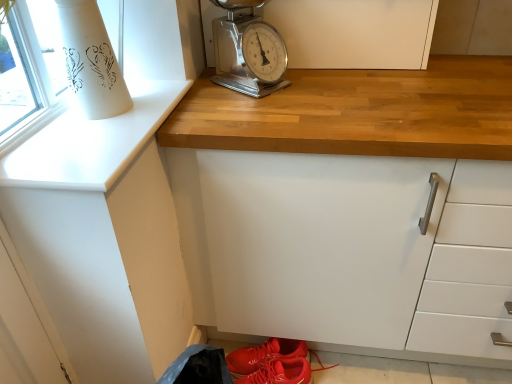
Question: Is metallic scale at upper center directly adjacent to white matte cabinet at upper center, placed as the first cabinetry when sorted from back to front?

Choices:
 (A) yes
 (B) no

Answer: (B)

Question: From the image's perspective, is metallic scale at upper center on white matte cabinet at upper center, the second cabinetry from the front?

Choices:
 (A) yes
 (B) no

Answer: (B)

Question: Is metallic scale at upper center not inside white matte cabinet at upper center, the second cabinetry from the front?

Choices:
 (A) yes
 (B) no

Answer: (A)

Question: Is metallic scale at upper center further to the viewer compared to white matte cabinet at upper center, placed as the first cabinetry when sorted from back to front?

Choices:
 (A) no
 (B) yes

Answer: (A)

Question: From a real-world perspective, is metallic scale at upper center on top of white matte cabinet at upper center, the second cabinetry from the front?

Choices:
 (A) yes
 (B) no

Answer: (A)

Question: Can you confirm if metallic scale at upper center is positioned to the right of white matte cabinet at upper center, the second cabinetry from the front?

Choices:
 (A) no
 (B) yes

Answer: (A)

Question: Could white matte cabinet at upper center, marked as the 1th cabinetry in a front-to-back arrangement, be considered to be inside white matte cabinet at upper center, placed as the first cabinetry when sorted from back to front?

Choices:
 (A) no
 (B) yes

Answer: (A)

Question: Is white matte cabinet at upper center, the second cabinetry from the front, looking in the opposite direction of white matte cabinet at upper center, marked as the 1th cabinetry in a front-to-back arrangement?

Choices:
 (A) yes
 (B) no

Answer: (B)

Question: Is white matte cabinet at upper center, the second cabinetry from the front, at the right side of white matte cabinet at upper center, marked as the 1th cabinetry in a front-to-back arrangement?

Choices:
 (A) yes
 (B) no

Answer: (A)

Question: Is white matte cabinet at upper center, the second cabinetry from the front, facing towards white matte cabinet at upper center, marked as the 1th cabinetry in a front-to-back arrangement?

Choices:
 (A) yes
 (B) no

Answer: (A)

Question: Is white matte cabinet at upper center, the second cabinetry from the front, further to the viewer compared to white matte cabinet at upper center, marked as the 1th cabinetry in a front-to-back arrangement?

Choices:
 (A) yes
 (B) no

Answer: (A)

Question: Can you see white matte cabinet at upper center, the second cabinetry from the front, touching white matte cabinet at upper center, placed as the 2th cabinetry when sorted from back to front?

Choices:
 (A) no
 (B) yes

Answer: (A)

Question: Considering the relative sizes of metallic scale at upper center and shiny leather sneakers at lower center in the image provided, is metallic scale at upper center bigger than shiny leather sneakers at lower center?

Choices:
 (A) yes
 (B) no

Answer: (A)